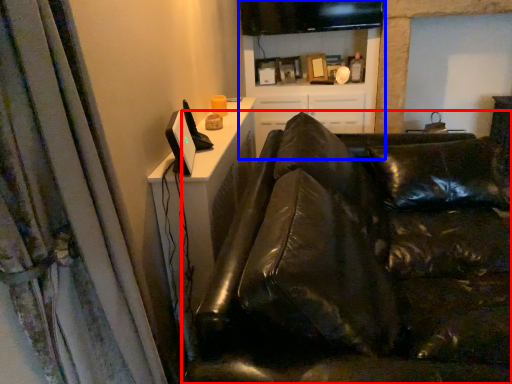
Question: Which object appears farthest to the camera in this image, studio couch (highlighted by a red box) or entertainment center (highlighted by a blue box)?

Choices:
 (A) studio couch
 (B) entertainment center

Answer: (B)